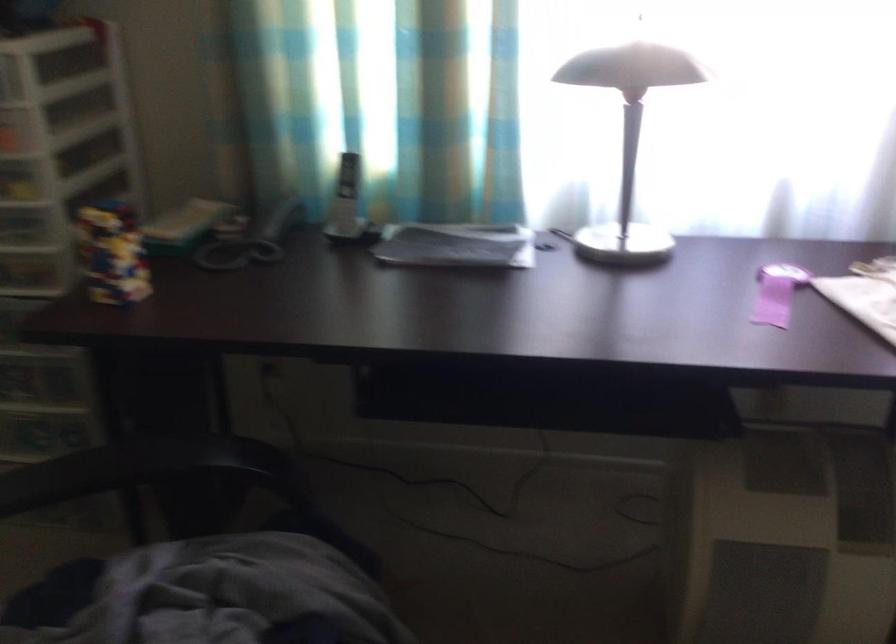
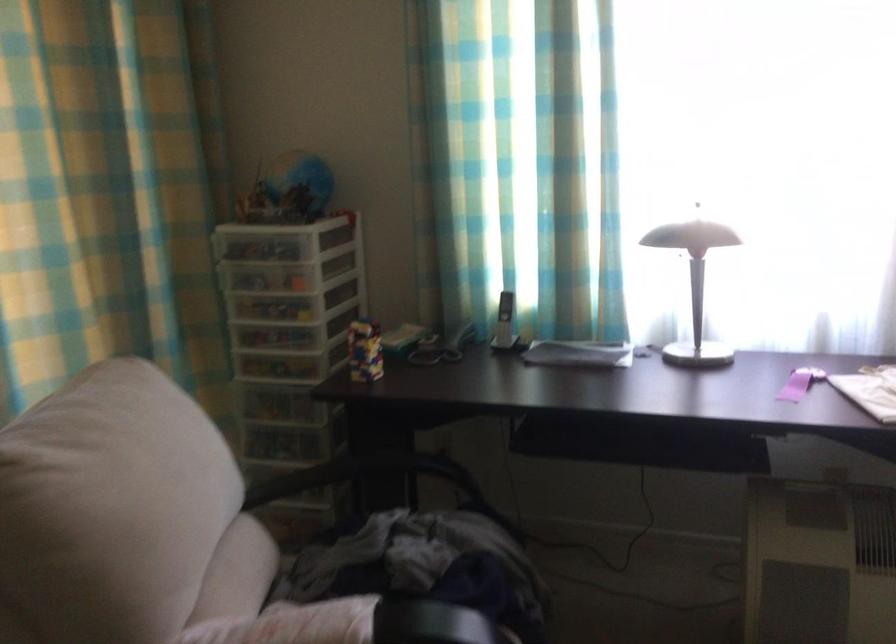
The point at (108, 480) is marked in the first image. Where is the corresponding point in the second image?

(362, 474)